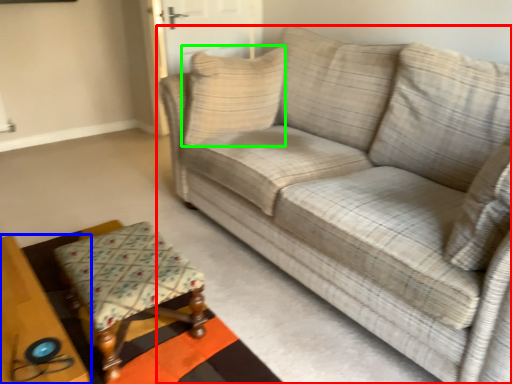
Question: Considering the real-world distances, which object is closest to studio couch (highlighted by a red box)? table (highlighted by a blue box) or pillow (highlighted by a green box).

Choices:
 (A) table
 (B) pillow

Answer: (B)